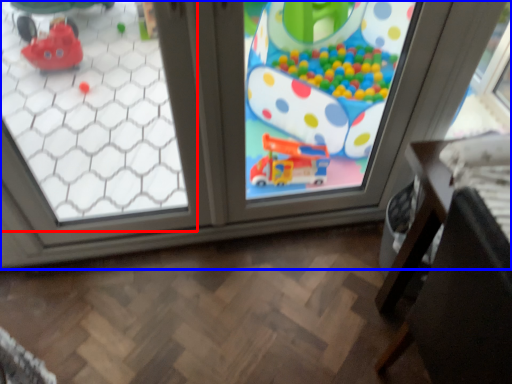
Question: Among these objects, which one is farthest to the camera, window (highlighted by a red box) or window (highlighted by a blue box)?

Choices:
 (A) window
 (B) window

Answer: (B)